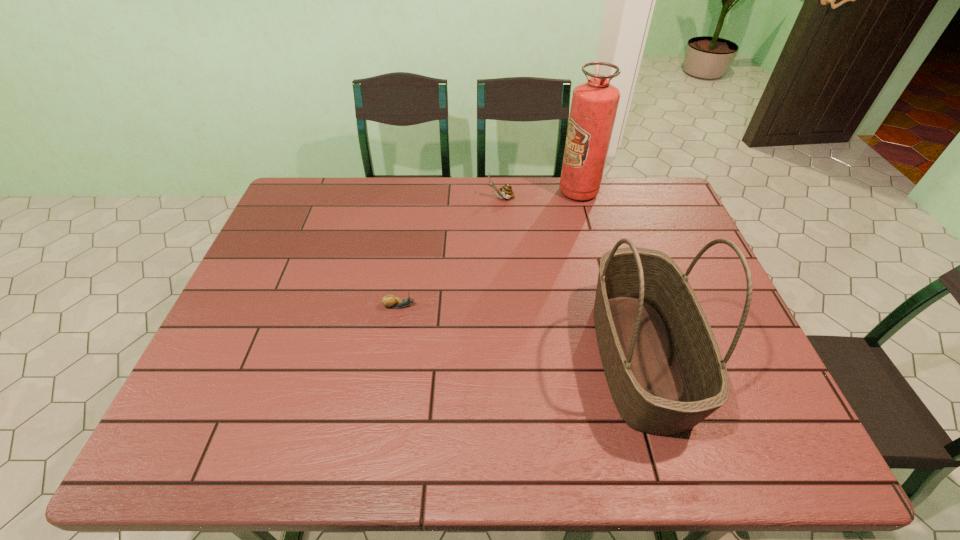
Locate an element on the screen. The image size is (960, 540). vacant space in between the second tallest object and the taller escargot is located at coordinates (570, 277).

Where is `empty space that is in between the nearer escargot and the taller escargot`? empty space that is in between the nearer escargot and the taller escargot is located at coordinates (450, 252).

Identify the location of object that is the closest to the tallest object. The height and width of the screenshot is (540, 960). [x=505, y=191].

The height and width of the screenshot is (540, 960). What are the coordinates of `object identified as the third closest to the tallest object` in the screenshot? It's located at [x=390, y=301].

This screenshot has height=540, width=960. Identify the location of free region that satisfies the following two spatial constraints: 1. on the label side of the fire extinguisher; 2. on the right side of the basket. (622, 356).

Where is `free space that satisfies the following two spatial constraints: 1. on the back side of the basket; 2. on the face of the taller escargot`? The width and height of the screenshot is (960, 540). free space that satisfies the following two spatial constraints: 1. on the back side of the basket; 2. on the face of the taller escargot is located at coordinates (592, 198).

This screenshot has width=960, height=540. In order to click on free space that satisfies the following two spatial constraints: 1. on the face of the right escargot; 2. on the right side of the third shortest object in this screenshot , I will do `click(510, 356)`.

Where is `free region that satisfies the following two spatial constraints: 1. on the front-facing side of the basket; 2. on the left side of the nearer escargot`? The height and width of the screenshot is (540, 960). free region that satisfies the following two spatial constraints: 1. on the front-facing side of the basket; 2. on the left side of the nearer escargot is located at coordinates (392, 356).

Find the location of `free location that satisfies the following two spatial constraints: 1. on the face of the second tallest object; 2. on the left side of the right escargot`. free location that satisfies the following two spatial constraints: 1. on the face of the second tallest object; 2. on the left side of the right escargot is located at coordinates (510, 356).

The image size is (960, 540). Identify the location of free space in the image that satisfies the following two spatial constraints: 1. on the face of the third object from right to left; 2. on the back side of the basket. (510, 356).